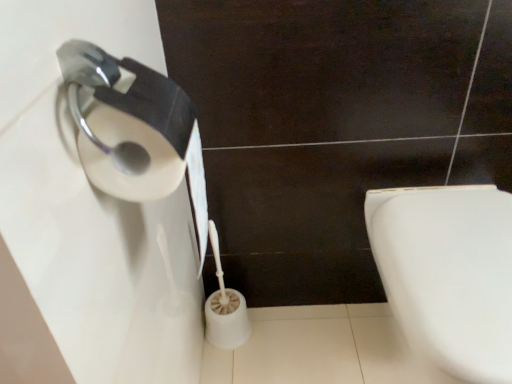
The image size is (512, 384). What do you see at coordinates (225, 307) in the screenshot?
I see `white matte toilet paper at lower center` at bounding box center [225, 307].

Identify the location of white matte toilet paper at lower center. (225, 307).

The width and height of the screenshot is (512, 384). What do you see at coordinates (448, 273) in the screenshot? I see `white glossy toilet at lower right` at bounding box center [448, 273].

Measure the distance between white glossy toilet at lower right and camera.

They are 23.07 inches apart.

This screenshot has width=512, height=384. What are the coordinates of `white glossy toilet at lower right` in the screenshot? It's located at (448, 273).

Image resolution: width=512 pixels, height=384 pixels. I want to click on white matte toilet paper at lower center, so click(225, 307).

Considering the positions of objects white glossy toilet at lower right and white matte toilet paper at lower center in the image provided, who is more to the left, white glossy toilet at lower right or white matte toilet paper at lower center?

white matte toilet paper at lower center is more to the left.

Is the depth of white glossy toilet at lower right greater than that of white matte toilet paper at lower center?

That is False.

Which is behind, point (464, 244) or point (209, 234)?

The point (209, 234) is farther from the camera.

From the image's perspective, is white glossy toilet at lower right positioned above or below white matte toilet paper at lower center?

Clearly, from the image's perspective, white glossy toilet at lower right is below white matte toilet paper at lower center.

From a real-world perspective, is white glossy toilet at lower right physically below white matte toilet paper at lower center?

Incorrect, from a real-world perspective, white glossy toilet at lower right is higher than white matte toilet paper at lower center.

Considering the relative sizes of white glossy toilet at lower right and white matte toilet paper at lower center in the image provided, is white glossy toilet at lower right wider than white matte toilet paper at lower center?

Yes.

Who is shorter, white glossy toilet at lower right or white matte toilet paper at lower center?

Standing shorter between the two is white glossy toilet at lower right.

Who is smaller, white glossy toilet at lower right or white matte toilet paper at lower center?

white matte toilet paper at lower center is smaller.

Which is correct: white glossy toilet at lower right is inside white matte toilet paper at lower center, or outside of it?

white glossy toilet at lower right is not inside white matte toilet paper at lower center, it's outside.

Is white glossy toilet at lower right not near white matte toilet paper at lower center?

They are positioned close to each other.

Is white glossy toilet at lower right facing away from white matte toilet paper at lower center?

No, white glossy toilet at lower right is not facing the opposite direction of white matte toilet paper at lower center.

Measure the distance between white glossy toilet at lower right and white matte toilet paper at lower center.

21.07 inches.

Find the location of a particular element. Image resolution: width=512 pixels, height=384 pixels. toilet paper above the white glossy toilet at lower right (from the image's perspective) is located at coordinates (225, 307).

From the picture: Between white matte toilet paper at lower center and white glossy toilet at lower right, which one appears on the left side from the viewer's perspective?

From the viewer's perspective, white matte toilet paper at lower center appears more on the left side.

Considering the relative positions of white matte toilet paper at lower center and white glossy toilet at lower right in the image provided, is white matte toilet paper at lower center in front of white glossy toilet at lower right?

No, white matte toilet paper at lower center is further to the viewer.

Is point (213, 320) farther from viewer compared to point (509, 228)?

Yes, point (213, 320) is farther from viewer.

From the image's perspective, which one is positioned lower, white matte toilet paper at lower center or white glossy toilet at lower right?

white glossy toilet at lower right, from the image's perspective.

From a real-world perspective, is white matte toilet paper at lower center positioned under white glossy toilet at lower right based on gravity?

Yes.

Between white matte toilet paper at lower center and white glossy toilet at lower right, which one has larger width?

Wider between the two is white glossy toilet at lower right.

Is white matte toilet paper at lower center shorter than white glossy toilet at lower right?

Incorrect, the height of white matte toilet paper at lower center does not fall short of that of white glossy toilet at lower right.

Considering the sizes of white matte toilet paper at lower center and white glossy toilet at lower right in the image, is white matte toilet paper at lower center bigger or smaller than white glossy toilet at lower right?

white matte toilet paper at lower center is smaller than white glossy toilet at lower right.

Is white matte toilet paper at lower center inside the boundaries of white glossy toilet at lower right, or outside?

The correct answer is: outside.

Consider the image. Would you consider white matte toilet paper at lower center to be distant from white glossy toilet at lower right?

No.

Is white matte toilet paper at lower center turned away from white glossy toilet at lower right?

That's not correct — white matte toilet paper at lower center is not looking away from white glossy toilet at lower right.

How different are the orientations of white matte toilet paper at lower center and white glossy toilet at lower right in degrees?

The facing directions of white matte toilet paper at lower center and white glossy toilet at lower right are 0.0297 degrees apart.

Measure the distance between white matte toilet paper at lower center and white glossy toilet at lower right.

The distance of white matte toilet paper at lower center from white glossy toilet at lower right is 21.07 inches.

At what (x,y) coordinates should I click in order to perform the action: click on toilet paper that is on the left side of white glossy toilet at lower right. Please return your answer as a coordinate pair (x, y). This screenshot has height=384, width=512. Looking at the image, I should click on (225, 307).

Where is `toilet below the white matte toilet paper at lower center (from the image's perspective)`? toilet below the white matte toilet paper at lower center (from the image's perspective) is located at coordinates pyautogui.click(x=448, y=273).

Where is `toilet that appears in front of the white matte toilet paper at lower center`? toilet that appears in front of the white matte toilet paper at lower center is located at coordinates (448, 273).